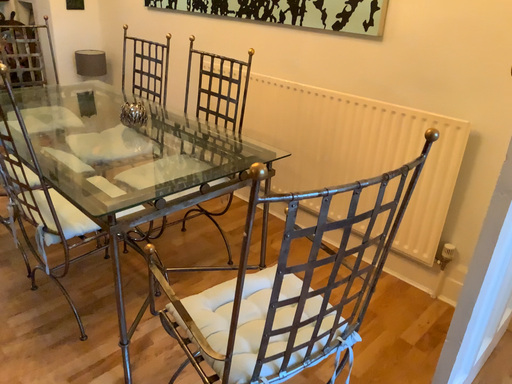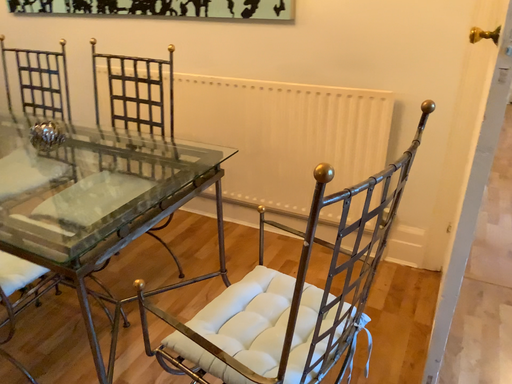
Question: Which way did the camera rotate in the video?

Choices:
 (A) rotated left
 (B) rotated right

Answer: (B)